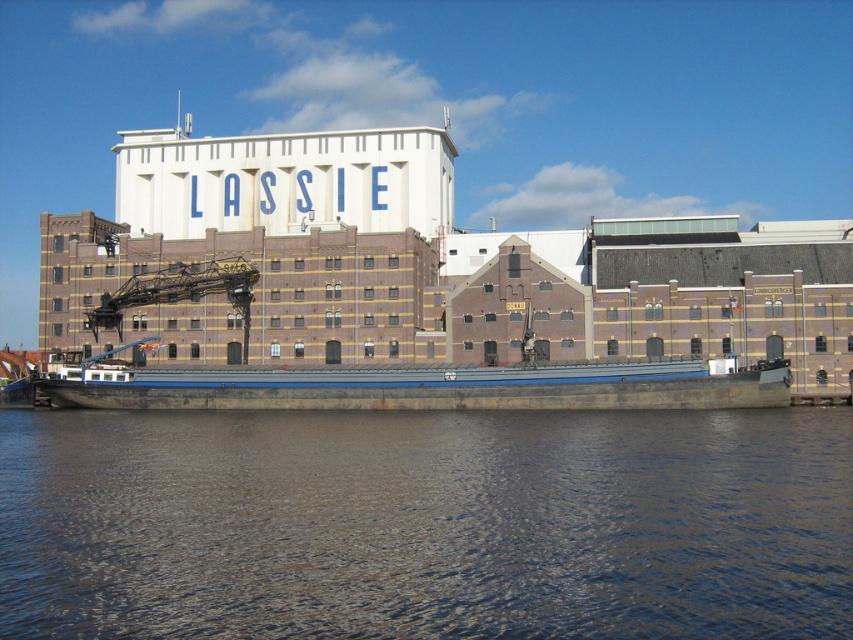
Does brown water at lower center have a greater width compared to blue painted steel barge at center?

Correct, the width of brown water at lower center exceeds that of blue painted steel barge at center.

This screenshot has width=853, height=640. What are the coordinates of `brown water at lower center` in the screenshot? It's located at (426, 524).

Does blue painted steel barge at center have a lesser height compared to dark gray metallic crane at center-left?

Yes.

Does point (553, 388) come farther from viewer compared to point (244, 321)?

No.

Between point (708, 392) and point (167, 289), which one is positioned behind?

Positioned behind is point (167, 289).

Locate an element on the screen. blue painted steel barge at center is located at coordinates (428, 387).

Is brown water at lower center thinner than dark gray metallic crane at center-left?

No, brown water at lower center is not thinner than dark gray metallic crane at center-left.

Is point (509, 465) farther from viewer compared to point (190, 269)?

No, (509, 465) is closer to viewer.

Which is in front, point (318, 433) or point (108, 294)?

Point (318, 433)

Where is `brown water at lower center`? This screenshot has height=640, width=853. brown water at lower center is located at coordinates (426, 524).